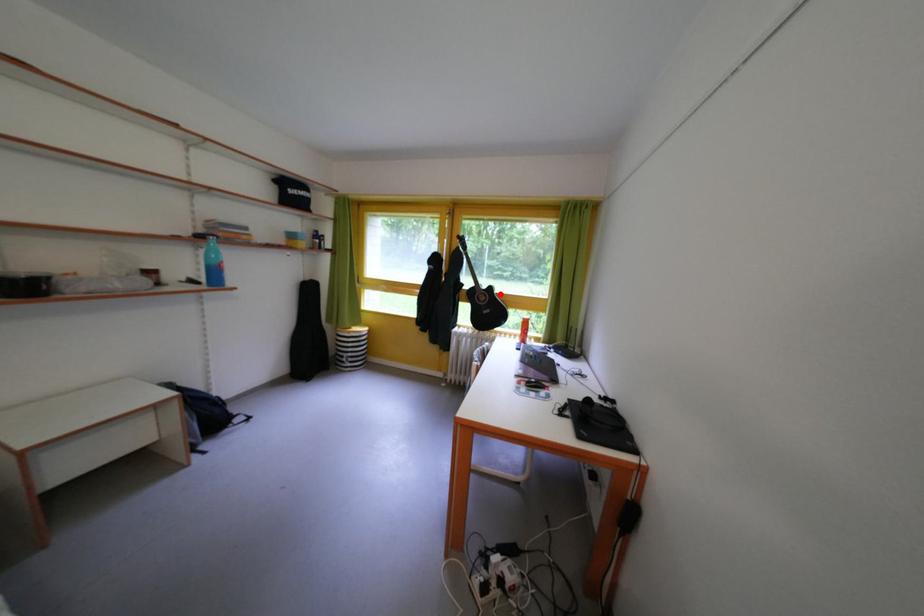
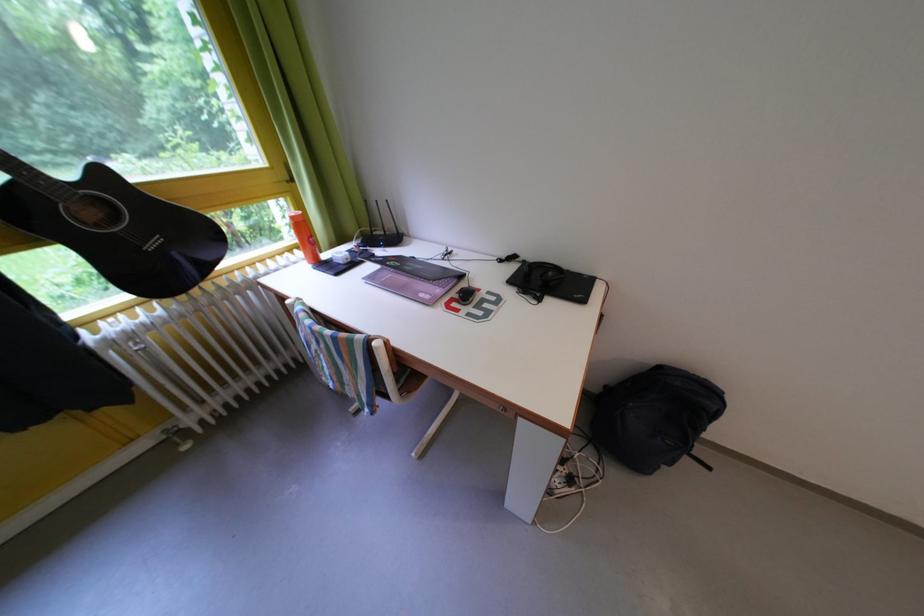
In the second image, find the point that corresponds to the highlighted location in the first image.

(112, 179)